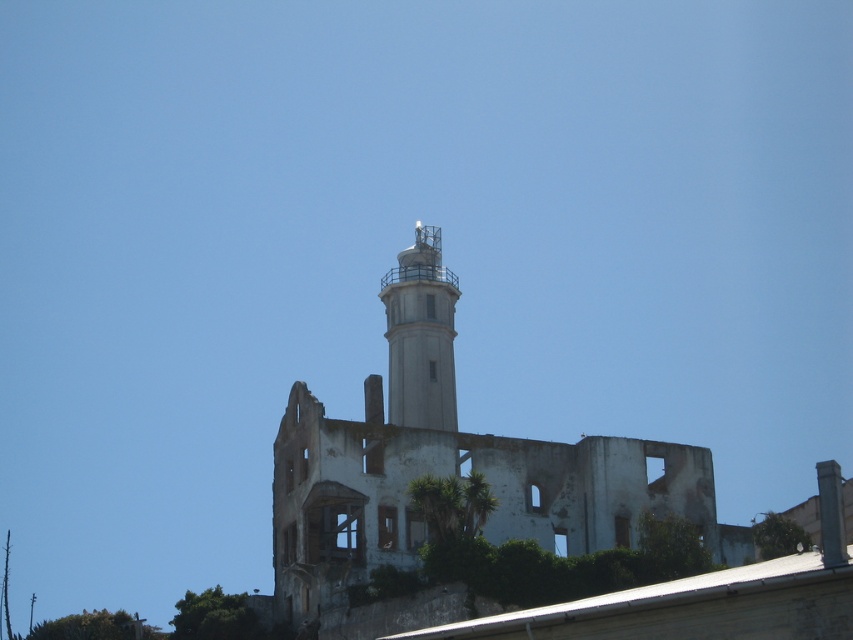
Looking at this image, you are an architect inspecting the ruins. You notice the white weathered concrete ruins at center and the white concrete tower at center. Which structure has a greater height?

The white weathered concrete ruins at center has a greater height compared to the white concrete tower at center.

You are a drone operator trying to capture aerial footage of the white weathered concrete ruins at center and the white concrete tower at center. From your current position, you notice that one of the structures is positioned to the right of the other. Which structure is located to the right?

The white weathered concrete ruins at center are positioned to the right of the white concrete tower at center.